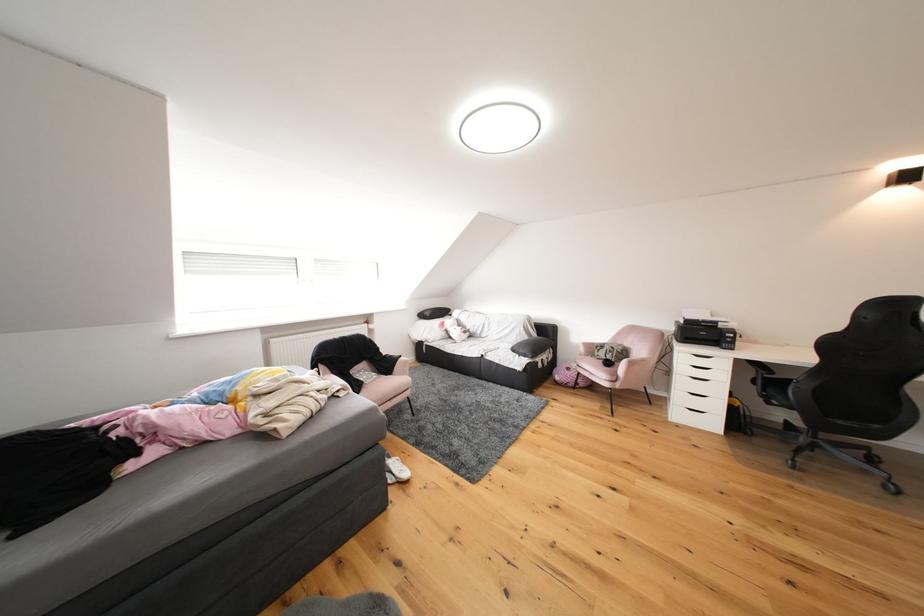
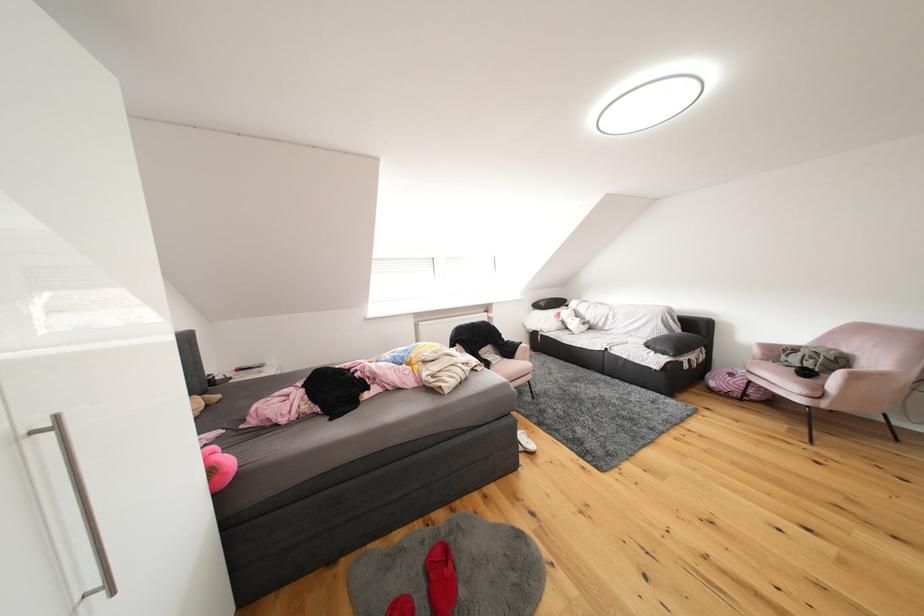
Locate, in the second image, the point that corresponds to (578,373) in the first image.

(740, 379)